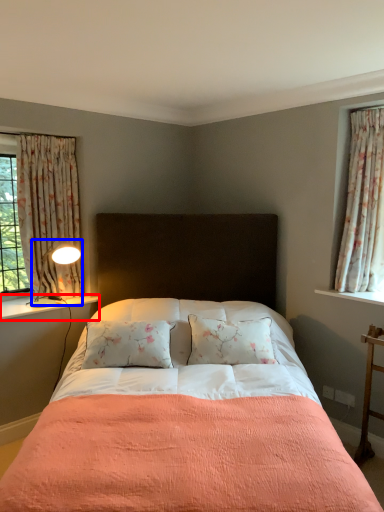
Question: Among these objects, which one is nearest to the camera, window sill (highlighted by a red box) or light fixture (highlighted by a blue box)?

Choices:
 (A) window sill
 (B) light fixture

Answer: (A)